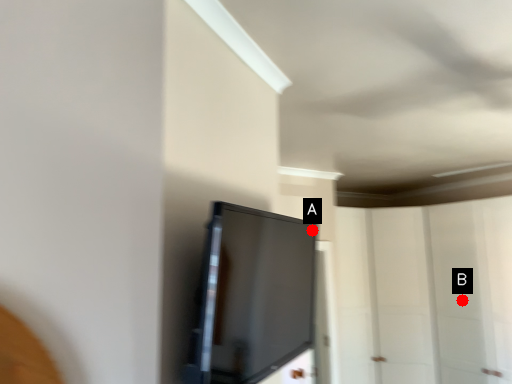
Question: Two points are circled on the image, labeled by A and B beside each circle. Which of the following is the farthest from the observer?

Choices:
 (A) A is further
 (B) B is further

Answer: (B)